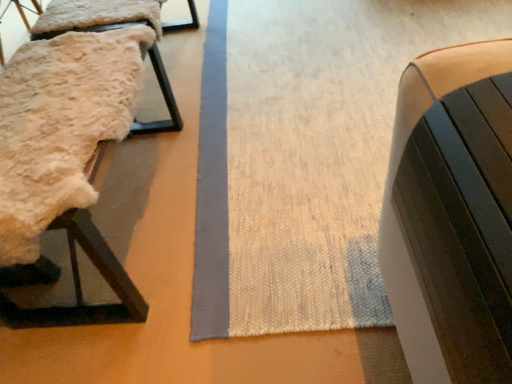
Question: From a real-world perspective, relative to fluffy sheepskin at left, marked as the second furniture in a back-to-front arrangement, is matte black bench at right, which ranks as the 3th furniture in back-to-front order, vertically above or below?

Choices:
 (A) below
 (B) above

Answer: (B)

Question: Is matte black bench at right, which is the 3th furniture in left-to-right order, in front of or behind fluffy sheepskin at left, marked as the second furniture in a back-to-front arrangement, in the image?

Choices:
 (A) behind
 (B) front

Answer: (B)

Question: Which object is the closest to the matte black bench at right, which ranks as the 3th furniture in back-to-front order?

Choices:
 (A) fuzzy sheepskin at left, marked as the second furniture in a right-to-left arrangement
 (B) fluffy sheepskin at left, positioned as the first furniture in left-to-right order

Answer: (B)

Question: Estimate the real-world distances between objects in this image. Which object is farther from the matte black bench at right, the 1th furniture in the right-to-left sequence?

Choices:
 (A) fuzzy sheepskin at left, which is counted as the second furniture, starting from the left
 (B) fluffy sheepskin at left, acting as the 3th furniture starting from the right

Answer: (A)